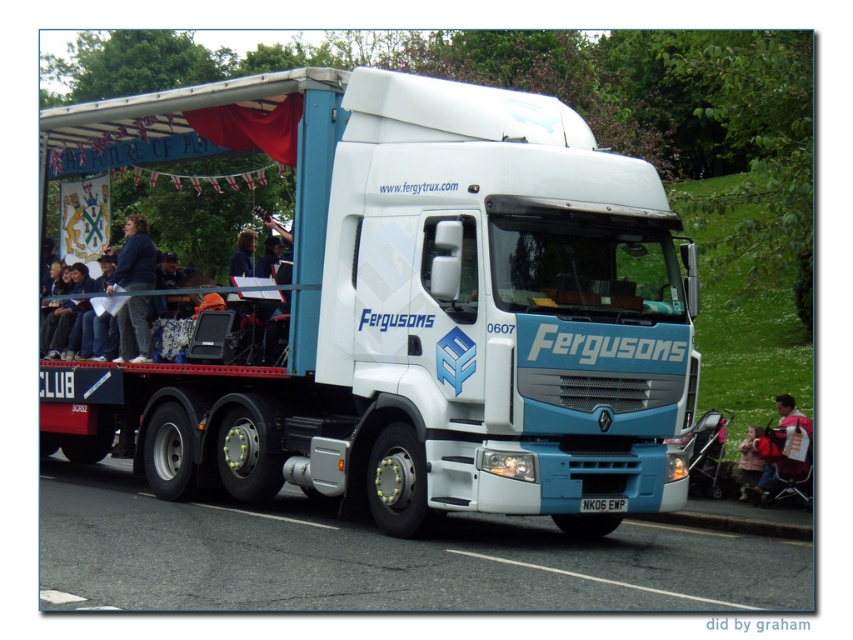
Consider the image. You are a photographer standing at the origin point of a coordinate system. You need to take a photo of the white glossy truck at center. What are the coordinates where you should aim your camera?

The white glossy truck at center is located at coordinates point (422, 316), so you should aim your camera at those coordinates to capture it.

You are a photographer trying to capture the white glossy truck at center and the dark blue fabric at left in a single frame. Based on their sizes, which object should you focus on to ensure both are visible without zooming in or out?

The white glossy truck at center has a smaller size compared to dark blue fabric at left, so you should focus on the dark blue fabric at left to ensure both are visible without adjusting the zoom.

From the picture: You are a photographer standing 20 feet away from the truck. You want to take a photo that includes both the dark blue fabric at left and the white plastic license plate at center without moving your position. Can you capture both in the same frame?

The dark blue fabric at left and white plastic license plate at center are 19.84 feet apart. Since you are standing 20 feet away from the truck, the distance between the two objects is slightly less than your distance from the truck. This means that with a wide enough lens, you can likely capture both in the same frame without moving your position.